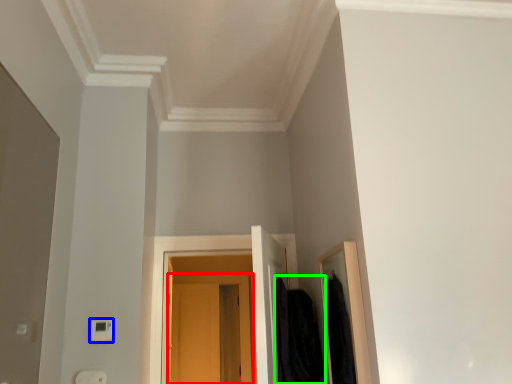
Question: Based on their relative distances, which object is farther from door (highlighted by a red box)? Choose from light switch (highlighted by a blue box) and clothing (highlighted by a green box).

Choices:
 (A) light switch
 (B) clothing

Answer: (A)